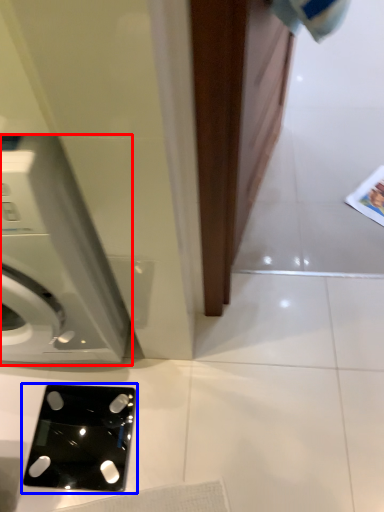
Question: Which object is closer to the camera taking this photo, washing machine (highlighted by a red box) or ipod (highlighted by a blue box)?

Choices:
 (A) washing machine
 (B) ipod

Answer: (A)